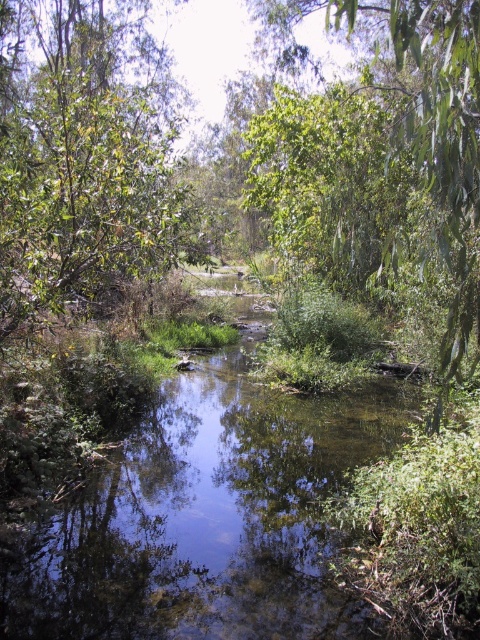
Does clear water at center have a greater height compared to green leafy tree at upper left?

Incorrect, clear water at center's height is not larger of green leafy tree at upper left's.

Is clear water at center below green leafy tree at upper left?

Yes, clear water at center is below green leafy tree at upper left.

The image size is (480, 640). Identify the location of clear water at center. tap(212, 516).

The height and width of the screenshot is (640, 480). What are the coordinates of `clear water at center` in the screenshot? It's located at (212, 516).